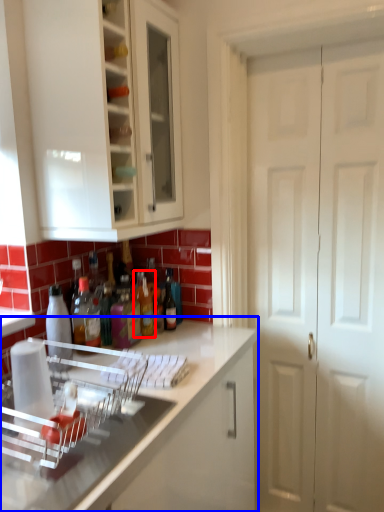
Question: Which of the following is the farthest to the observer, bottle (highlighted by a red box) or countertop (highlighted by a blue box)?

Choices:
 (A) bottle
 (B) countertop

Answer: (A)